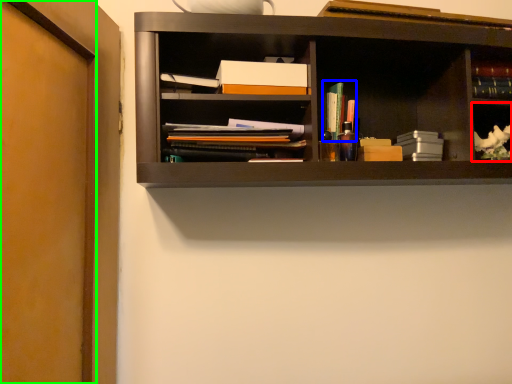
Question: Which is nearer to the cabinet (highlighted by a red box)? book (highlighted by a blue box) or door (highlighted by a green box).

Choices:
 (A) book
 (B) door

Answer: (A)